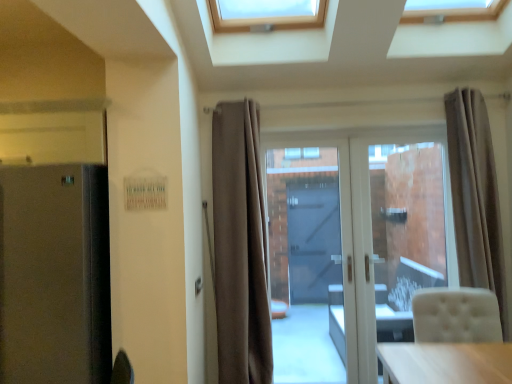
Question: Considering the positions of point (102, 372) and point (330, 382), is point (102, 372) closer or farther from the camera than point (330, 382)?

Choices:
 (A) closer
 (B) farther

Answer: (A)

Question: Is satin black fridge at left spatially inside transparent glass door at center, or outside of it?

Choices:
 (A) outside
 (B) inside

Answer: (A)

Question: Which of these objects is positioned closest to the beige fabric curtain at center, the 1th curtain positioned from the left?

Choices:
 (A) satin black fridge at left
 (B) white glossy door at center
 (C) transparent glass door at center
 (D) transparent glass door at center
 (E) beige fabric curtain at right, the 2th curtain in the left-to-right sequence

Answer: (B)

Question: Based on their relative distances, which object is nearer to the transparent glass door at center?

Choices:
 (A) beige fabric curtain at center, the 1th curtain positioned from the left
 (B) transparent glass door at center
 (C) satin black fridge at left
 (D) white glossy door at center
 (E) beige fabric curtain at right, which is the first curtain from right to left

Answer: (B)